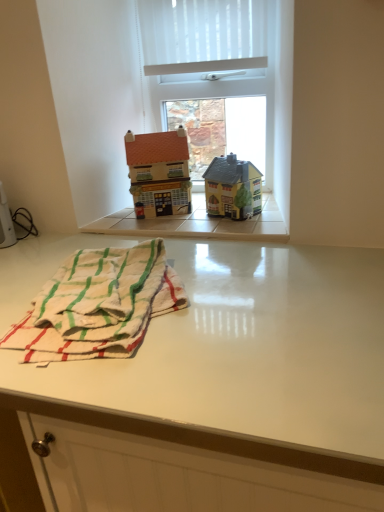
Locate an element on the screen. Image resolution: width=384 pixels, height=512 pixels. vacant area situated to the left side of yellow matte house at center, the 1th toy from the right is located at coordinates (180, 222).